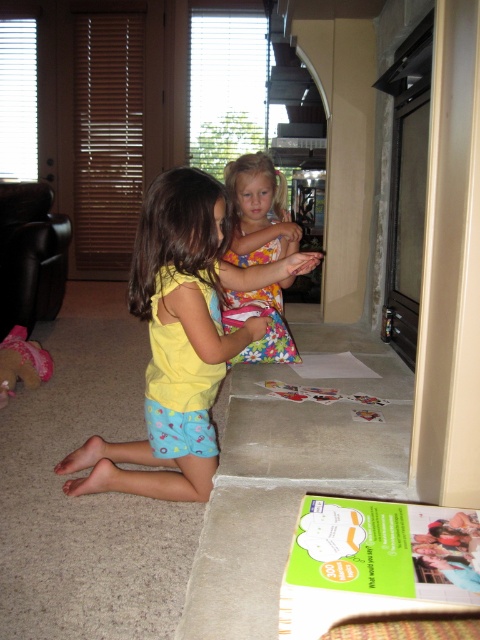
Where is the yellow fabric shirt at center located in the image?

The yellow fabric shirt at center is located at point (x=180, y=339) in the image.

You are a parent trying to decide which item to put away first. The yellow fabric shirt at center and the pink fabric toy at lower left are both on the floor. Which item takes up more space on the floor?

The yellow fabric shirt at center has a larger size compared to the pink fabric toy at lower left, so it takes up more space on the floor.